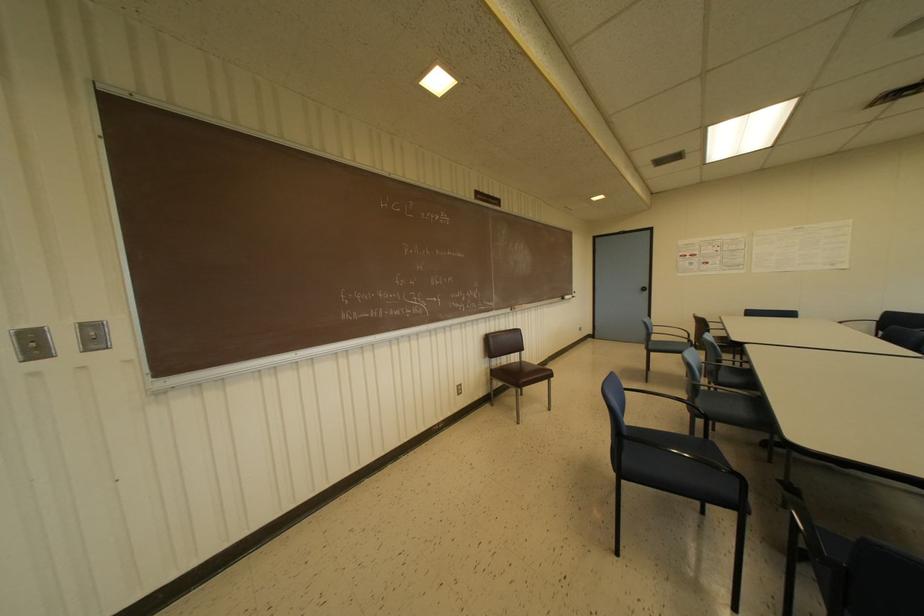
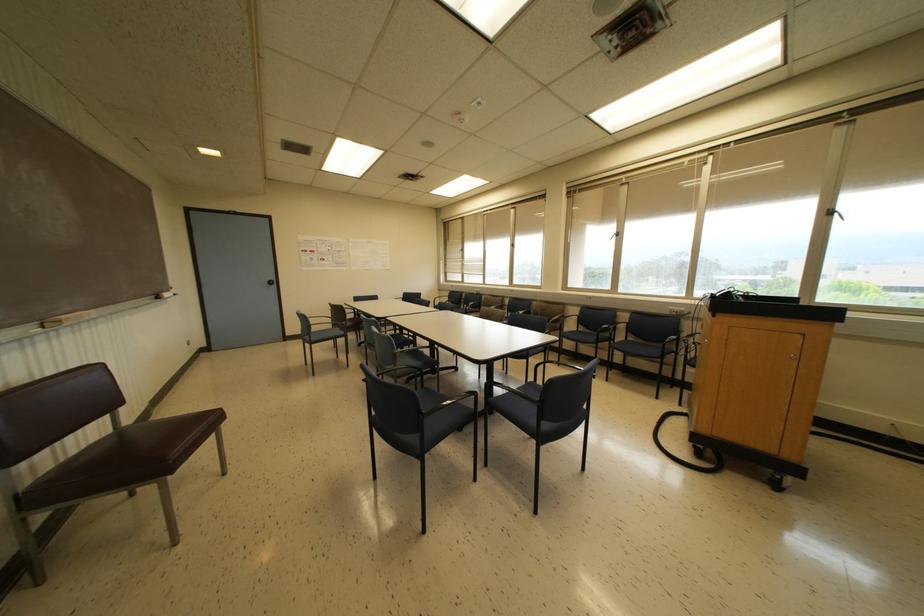
The point at (646, 288) is marked in the first image. Where is the corresponding point in the second image?

(274, 282)